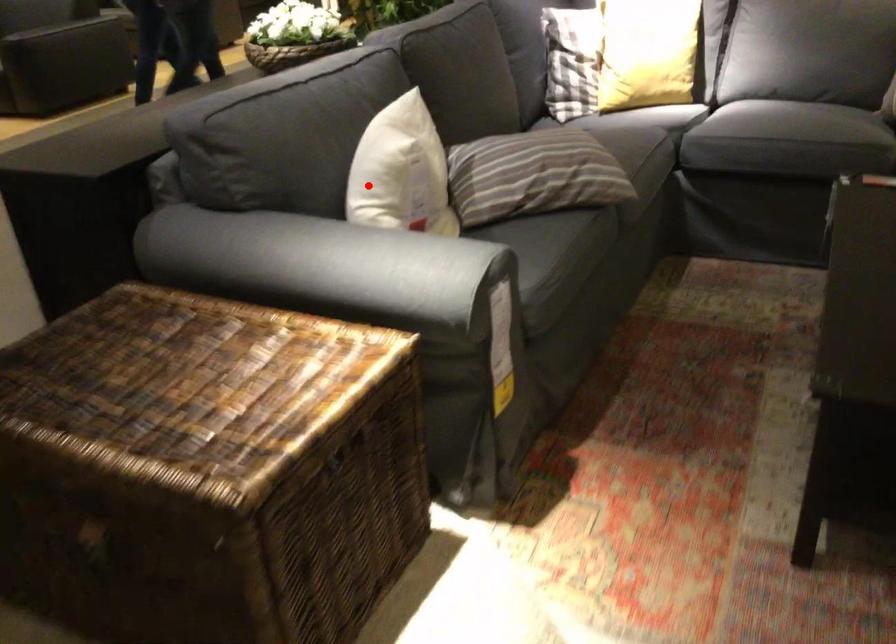
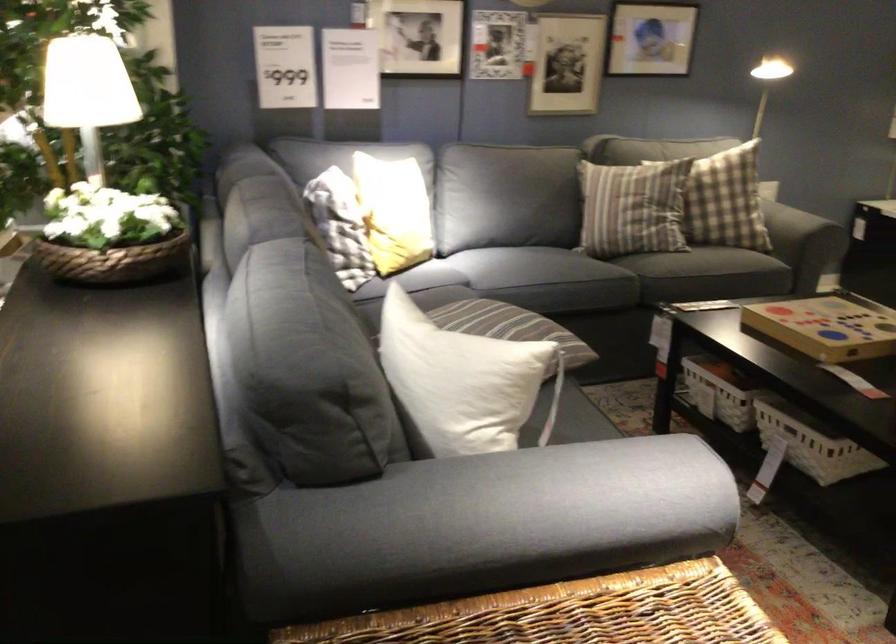
Question: A red point is marked in image1. In image2, is the corresponding 3D point closer to the camera or farther? Reply with the corresponding letter.

Choices:
 (A) The corresponding 3D point is closer.
 (B) The corresponding 3D point is farther.

Answer: (A)